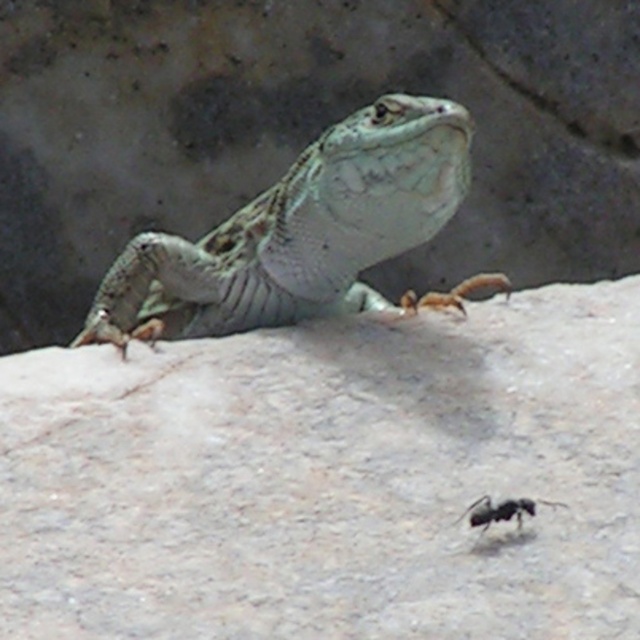
Consider the image. You are a photographer adjusting your camera to focus on two specific points in the image. The first point is labeled as point (218, 326) and the second is point (483, 509). Since you can only focus on one point at a time, which point should you choose to ensure the lizard resting on the rock is in sharp focus?

You should focus on point (218, 326) because it is closer to the camera than point (483, 509), and the lizard is likely positioned at the point closer to the camera for better focus.

Where is the speckled green lizard at center located in the image?

The speckled green lizard at center is located at point coordinates of 0.367 on the x axis and 0.475 on the y axis.

You are an entomologist observing this scene. You need to capture a photo of the black matte ant at lower center without disturbing the speckled green lizard at center. Since the lizard is above the ant, how should you position your camera to avoid blocking the ant?

The speckled green lizard at center is above the black matte ant at lower center, so you should position your camera below the lizard to capture the ant without obstruction.